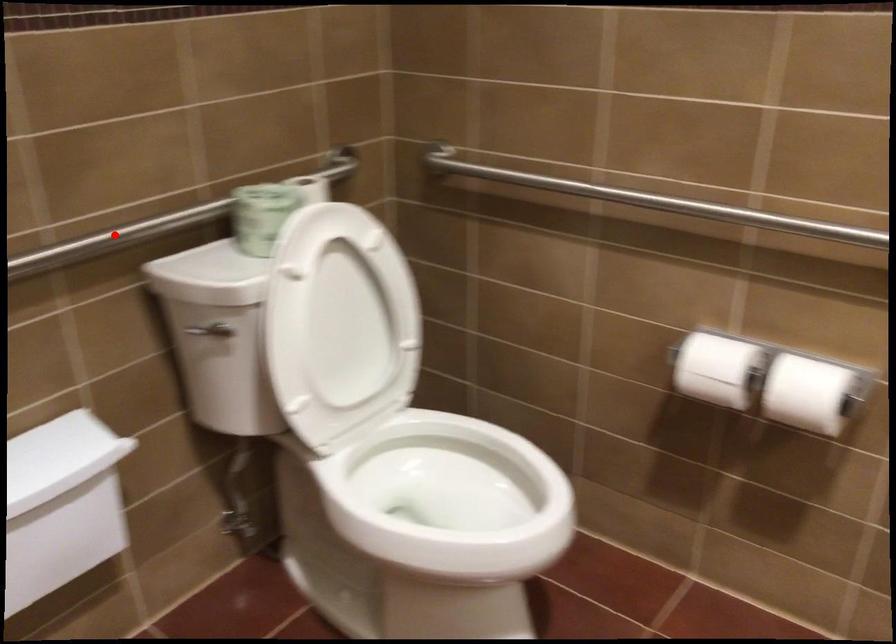
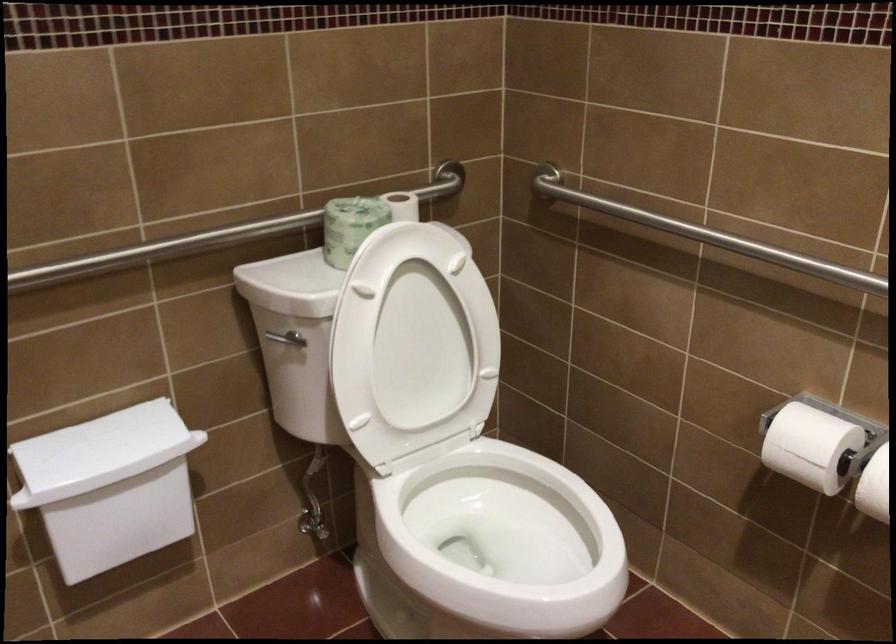
Locate, in the second image, the point that corresponds to the highlighted location in the first image.

(204, 239)